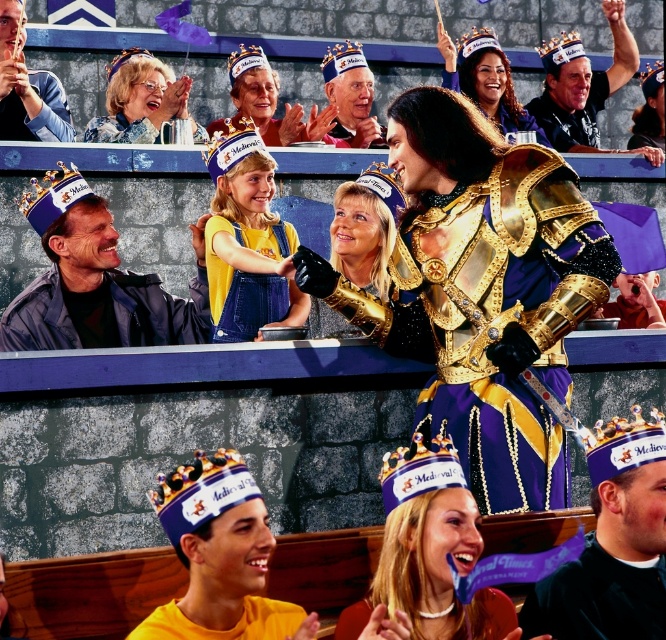
Question: Does purple velvet crown at center appear over matte blue crown at upper left?

Choices:
 (A) no
 (B) yes

Answer: (A)

Question: Among these objects, which one is nearest to the camera?

Choices:
 (A) purple velvet crown at center
 (B) matte blue crown at upper left
 (C) yellow denim overalls at center
 (D) matte purple crown at upper center

Answer: (A)

Question: Among these points, which one is farthest from the camera?

Choices:
 (A) (220, 291)
 (B) (392, 128)

Answer: (A)

Question: Does matte blue crown at upper left have a smaller size compared to purple fabric crown at upper center?

Choices:
 (A) yes
 (B) no

Answer: (B)

Question: Which is farther from the purple velvet crown at center?

Choices:
 (A) yellow denim overalls at center
 (B) matte purple crown at upper center
 (C) matte gold armor at center
 (D) purple fabric crown at upper center

Answer: (D)

Question: Is purple velvet crown at center closer to camera compared to purple fabric crown at upper center?

Choices:
 (A) yes
 (B) no

Answer: (A)